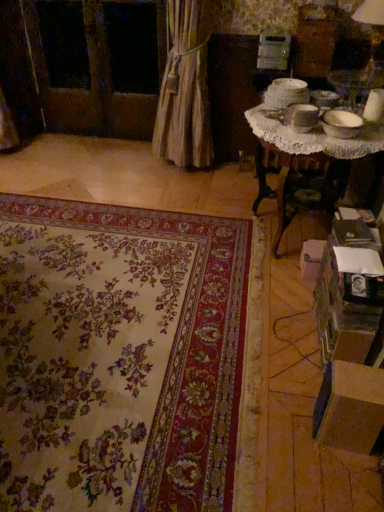
Question: Is white cardboard box at lower right, which is the 1th cardboard box in back-to-front order, further to camera compared to matte white table lamp at upper right?

Choices:
 (A) yes
 (B) no

Answer: (B)

Question: Can you confirm if white cardboard box at lower right, the 2th cardboard box when ordered from bottom to top, is wider than matte white table lamp at upper right?

Choices:
 (A) no
 (B) yes

Answer: (A)

Question: Is white cardboard box at lower right, which is the second cardboard box from front to back, positioned with its back to matte white table lamp at upper right?

Choices:
 (A) no
 (B) yes

Answer: (A)

Question: Is white cardboard box at lower right, which is the 1th cardboard box in back-to-front order, bigger than matte white table lamp at upper right?

Choices:
 (A) yes
 (B) no

Answer: (B)

Question: From a real-world perspective, is white cardboard box at lower right, the 2th cardboard box when ordered from bottom to top, over matte white table lamp at upper right?

Choices:
 (A) yes
 (B) no

Answer: (B)

Question: From a real-world perspective, is white cardboard box at lower right, the 1th cardboard box positioned from the top, physically below matte white table lamp at upper right?

Choices:
 (A) yes
 (B) no

Answer: (A)

Question: Is floral carpet at center turned away from white cardboard box at lower right, which is the 1th cardboard box in back-to-front order?

Choices:
 (A) yes
 (B) no

Answer: (B)

Question: Can you confirm if floral carpet at center is positioned to the left of white cardboard box at lower right, which is the second cardboard box from front to back?

Choices:
 (A) yes
 (B) no

Answer: (A)

Question: Can you confirm if floral carpet at center is positioned to the right of white cardboard box at lower right, the 2th cardboard box when ordered from bottom to top?

Choices:
 (A) no
 (B) yes

Answer: (A)

Question: From a real-world perspective, does floral carpet at center sit lower than white cardboard box at lower right, which is the 1th cardboard box in back-to-front order?

Choices:
 (A) no
 (B) yes

Answer: (B)

Question: From a real-world perspective, does floral carpet at center stand above white cardboard box at lower right, the 1th cardboard box positioned from the top?

Choices:
 (A) yes
 (B) no

Answer: (B)

Question: Considering the relative sizes of floral carpet at center and white cardboard box at lower right, the 1th cardboard box positioned from the top, in the image provided, is floral carpet at center bigger than white cardboard box at lower right, the 1th cardboard box positioned from the top,?

Choices:
 (A) no
 (B) yes

Answer: (B)

Question: Is the depth of beige fabric curtain at left less than that of matte white table lamp at upper right?

Choices:
 (A) yes
 (B) no

Answer: (B)